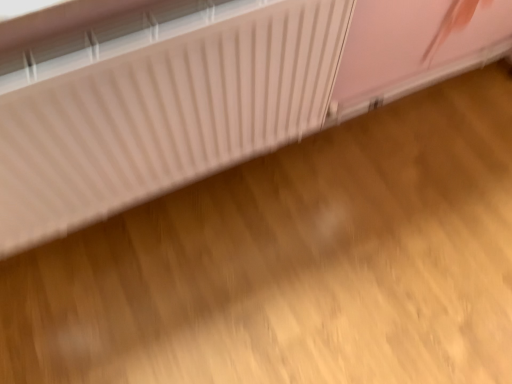
Find the location of a particular element. The height and width of the screenshot is (384, 512). vacant area that is in front of white matte radiator at upper left is located at coordinates (286, 266).